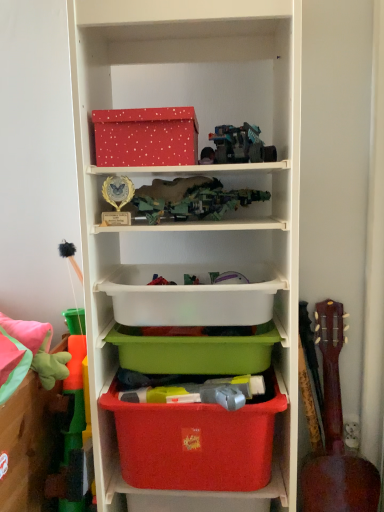
Question: Considering the relative sizes of matte plastic shelf at center and red dotted cardboard box at upper center in the image provided, is matte plastic shelf at center taller than red dotted cardboard box at upper center?

Choices:
 (A) yes
 (B) no

Answer: (A)

Question: Does matte plastic shelf at center have a lesser width compared to red dotted cardboard box at upper center?

Choices:
 (A) no
 (B) yes

Answer: (A)

Question: Can red dotted cardboard box at upper center be found inside matte plastic shelf at center?

Choices:
 (A) yes
 (B) no

Answer: (A)

Question: Considering the relative sizes of matte plastic shelf at center and red dotted cardboard box at upper center in the image provided, is matte plastic shelf at center smaller than red dotted cardboard box at upper center?

Choices:
 (A) no
 (B) yes

Answer: (A)

Question: From the image's perspective, is matte plastic shelf at center over red dotted cardboard box at upper center?

Choices:
 (A) yes
 (B) no

Answer: (B)

Question: Is matte plastic shelf at center taller or shorter than matte plastic storage box at left, the second storage box positioned from the bottom?

Choices:
 (A) tall
 (B) short

Answer: (A)

Question: Considering the positions of matte plastic shelf at center and matte plastic storage box at left, the third storage box positioned from the top, in the image, is matte plastic shelf at center bigger or smaller than matte plastic storage box at left, the third storage box positioned from the top,?

Choices:
 (A) big
 (B) small

Answer: (A)

Question: Considering the positions of point (228, 91) and point (19, 445), is point (228, 91) closer or farther from the camera than point (19, 445)?

Choices:
 (A) closer
 (B) farther

Answer: (B)

Question: From a real-world perspective, relative to matte plastic storage box at left, the second storage box positioned from the bottom, is matte plastic shelf at center vertically above or below?

Choices:
 (A) above
 (B) below

Answer: (A)

Question: From the image's perspective, is teal plastic toy truck at upper center, marked as the second toy in a left-to-right arrangement, above or below green plastic toy at left, the 2th toy in the front-to-back sequence?

Choices:
 (A) above
 (B) below

Answer: (A)

Question: From their relative heights in the image, would you say teal plastic toy truck at upper center, the 1th toy from the right, is taller or shorter than green plastic toy at left, the 2th toy in the front-to-back sequence?

Choices:
 (A) tall
 (B) short

Answer: (B)

Question: Is teal plastic toy truck at upper center, the 1th toy from the right, spatially inside green plastic toy at left, which is counted as the first toy, starting from the bottom, or outside of it?

Choices:
 (A) inside
 (B) outside

Answer: (B)

Question: Is point (215, 126) positioned closer to the camera than point (64, 438)?

Choices:
 (A) closer
 (B) farther

Answer: (B)

Question: Does point (331, 380) appear closer or farther from the camera than point (216, 450)?

Choices:
 (A) farther
 (B) closer

Answer: (A)

Question: Looking at their shapes, would you say brown wooden guitar at right is wider or thinner than matte plastic storage box at lower center, which is counted as the fourth storage box, starting from the top?

Choices:
 (A) wide
 (B) thin

Answer: (A)